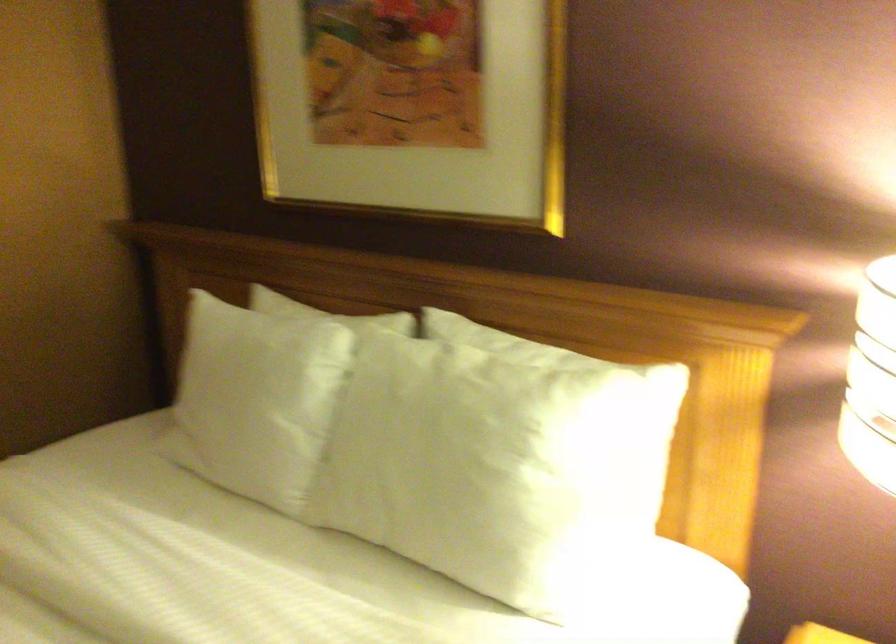
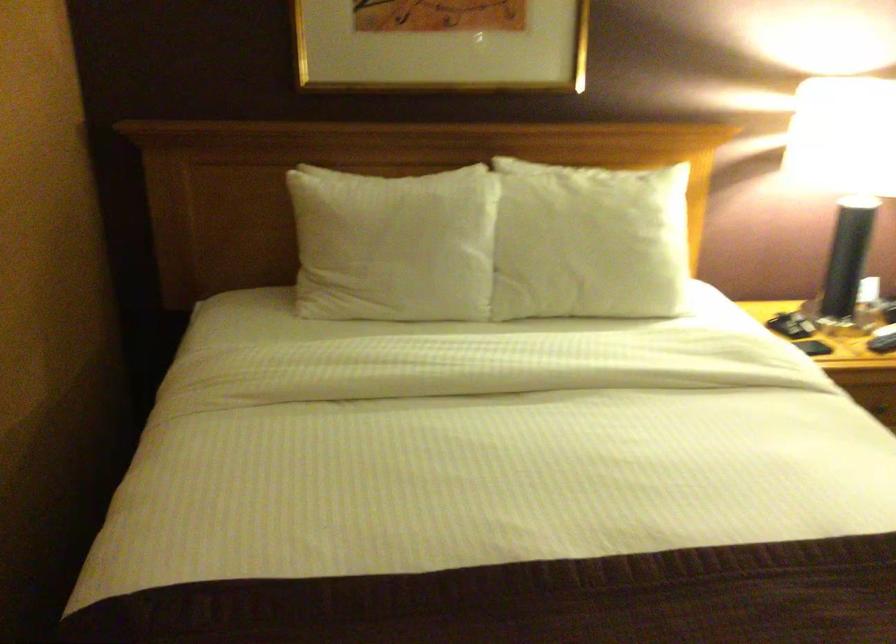
Find the pixel in the second image that matches point 431,453 in the first image.

(589, 242)